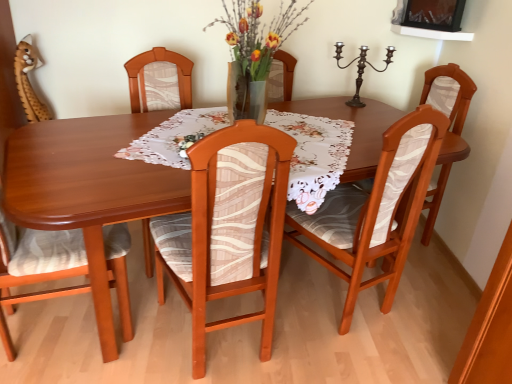
Question: From their relative heights in the image, would you say wooden table at center is taller or shorter than wooden chair at right, which is counted as the 5th chair, starting from the left?

Choices:
 (A) short
 (B) tall

Answer: (A)

Question: Relative to wooden chair at right, which is the 1th chair from right to left, is wooden table at center in front or behind?

Choices:
 (A) behind
 (B) front

Answer: (B)

Question: Considering the real-world distances, which object is closest to the wooden chair at right, which is the 1th chair from right to left?

Choices:
 (A) wooden chair with patterned fabric at center, placed as the third chair when sorted from left to right
 (B) floral lace tablecloth at center
 (C) wooden chair at center, which is the fourth chair from left to right
 (D) wooden chair at center, acting as the second chair starting from the left
 (E) brown plush toy at upper left

Answer: (C)

Question: Based on their relative distances, which object is nearer to the wooden table at center?

Choices:
 (A) wooden chair at center, the 2th chair viewed from the right
 (B) wooden chair at right, which is the 1th chair from right to left
 (C) wooden chair at center, acting as the second chair starting from the left
 (D) bronze metallic candle holder at upper right
 (E) wooden chair with patterned fabric at center, which ranks as the 3th chair in right-to-left order

Answer: (E)